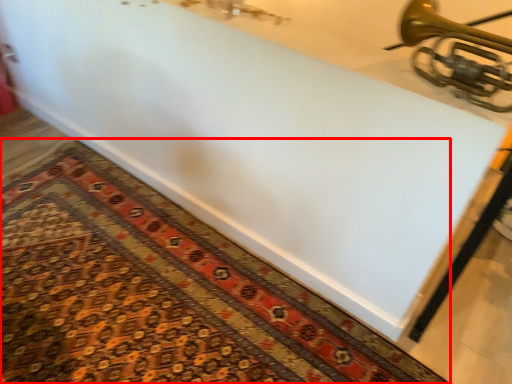
Question: Where is mat (annotated by the red box) located in relation to musical instrument in the image?

Choices:
 (A) left
 (B) right

Answer: (A)